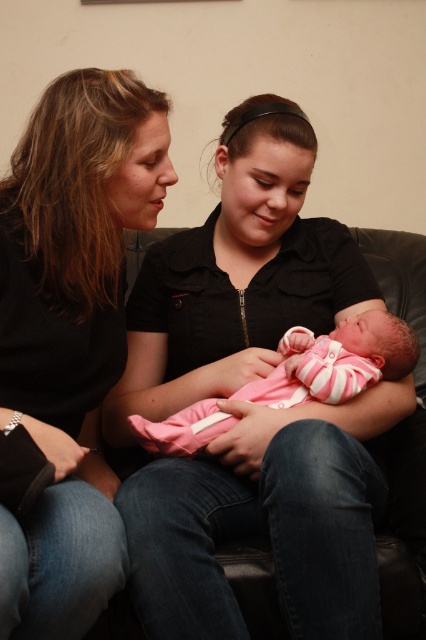
Consider the image. Which is more to the right, pink matte fabric baby at center or matte black shirt at upper left?

pink matte fabric baby at center is more to the right.

Does pink matte fabric baby at center have a lesser width compared to matte black shirt at upper left?

In fact, pink matte fabric baby at center might be wider than matte black shirt at upper left.

You are a GUI agent. You are given a task and a screenshot of the screen. Output one action in this format:
    pyautogui.click(x=<x>, y=<y>)
    Task: Click on the pink matte fabric baby at center
    The width and height of the screenshot is (426, 640).
    Given the screenshot: What is the action you would take?
    pyautogui.click(x=267, y=518)

Can you confirm if matte black shirt at upper left is positioned below pink striped fabric newborn at center?

Incorrect, matte black shirt at upper left is not positioned below pink striped fabric newborn at center.

Does matte black shirt at upper left lie behind pink striped fabric newborn at center?

No.

Locate an element on the screen. matte black shirt at upper left is located at coordinates (69, 339).

Between point (124, 499) and point (282, 401), which one is positioned in front?

Positioned in front is point (124, 499).

Is point (187, 628) in front of point (190, 452)?

Yes, point (187, 628) is closer to viewer.

Between point (235, 605) and point (131, 426), which one is positioned in front?

Point (235, 605) is in front.

Identify the location of pink matte fabric baby at center. This screenshot has height=640, width=426. (267, 518).